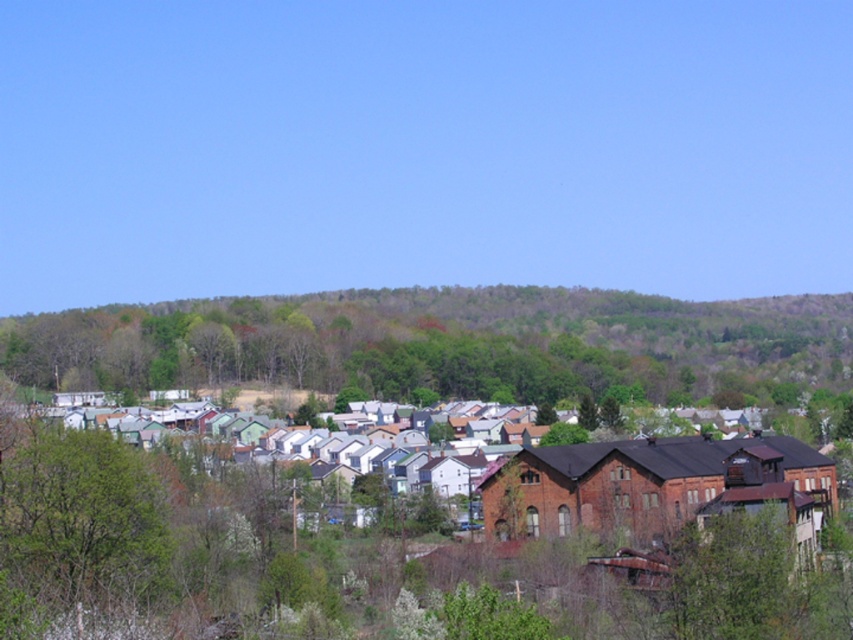
Question: Which of the following is the closest to the observer?

Choices:
 (A) green leafy hillside at upper center
 (B) green leafy tree at lower left

Answer: (B)

Question: Is the position of green leafy hillside at upper center more distant than that of green leafy tree at lower left?

Choices:
 (A) yes
 (B) no

Answer: (A)

Question: Can you confirm if green leafy hillside at upper center is smaller than green leafy tree at lower left?

Choices:
 (A) yes
 (B) no

Answer: (B)

Question: Which object appears farthest from the camera in this image?

Choices:
 (A) green leafy hillside at upper center
 (B) green leafy tree at lower left

Answer: (A)

Question: Does green leafy hillside at upper center have a lesser width compared to green leafy tree at lower left?

Choices:
 (A) no
 (B) yes

Answer: (A)